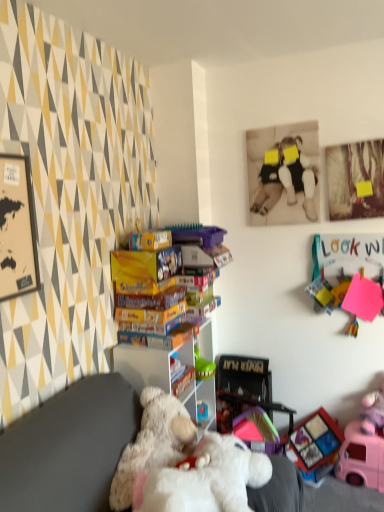
Question: Considering the relative sizes of white plastic shelf at center and pink plastic toy car at lower right, marked as the fourth toy in a top-to-bottom arrangement, in the image provided, is white plastic shelf at center smaller than pink plastic toy car at lower right, marked as the fourth toy in a top-to-bottom arrangement,?

Choices:
 (A) no
 (B) yes

Answer: (A)

Question: From a real-world perspective, is white plastic shelf at center beneath pink plastic toy car at lower right, marked as the fourth toy in a top-to-bottom arrangement?

Choices:
 (A) yes
 (B) no

Answer: (B)

Question: From a real-world perspective, is white plastic shelf at center on top of pink plastic toy car at lower right, marked as the fourth toy in a top-to-bottom arrangement?

Choices:
 (A) yes
 (B) no

Answer: (A)

Question: Can you confirm if white plastic shelf at center is wider than pink plastic toy car at lower right, marked as the fourth toy in a top-to-bottom arrangement?

Choices:
 (A) no
 (B) yes

Answer: (B)

Question: Could you tell me if white plastic shelf at center is turned towards pink plastic toy car at lower right, marked as the fourth toy in a top-to-bottom arrangement?

Choices:
 (A) yes
 (B) no

Answer: (A)

Question: In the image, is matte plastic toy at lower right, positioned as the third toy in top-to-bottom order, positioned in front of or behind white plush bear at center?

Choices:
 (A) front
 (B) behind

Answer: (B)

Question: From a real-world perspective, is matte plastic toy at lower right, positioned as the third toy in top-to-bottom order, positioned above or below white plush bear at center?

Choices:
 (A) below
 (B) above

Answer: (A)

Question: In terms of size, does matte plastic toy at lower right, which ranks as the second toy in bottom-to-top order, appear bigger or smaller than white plush bear at center?

Choices:
 (A) big
 (B) small

Answer: (B)

Question: Looking at their shapes, would you say matte plastic toy at lower right, positioned as the third toy in top-to-bottom order, is wider or thinner than white plush bear at center?

Choices:
 (A) wide
 (B) thin

Answer: (B)

Question: Does point (347, 424) appear closer or farther from the camera than point (365, 409)?

Choices:
 (A) farther
 (B) closer

Answer: (A)

Question: From the image's perspective, is pink plastic toy car at lower right, the first toy ordered from the bottom, positioned above or below pink fabric doll at lower right, arranged as the 3th toy when ordered from the bottom?

Choices:
 (A) above
 (B) below

Answer: (B)

Question: Looking at the image, does pink plastic toy car at lower right, marked as the fourth toy in a top-to-bottom arrangement, seem bigger or smaller compared to pink fabric doll at lower right, arranged as the second toy when viewed from the top?

Choices:
 (A) small
 (B) big

Answer: (B)

Question: Would you say pink plastic toy car at lower right, the first toy ordered from the bottom, is inside or outside pink fabric doll at lower right, arranged as the 3th toy when ordered from the bottom?

Choices:
 (A) inside
 (B) outside

Answer: (B)

Question: Is point (314, 432) closer or farther from the camera than point (364, 398)?

Choices:
 (A) farther
 (B) closer

Answer: (A)

Question: From a real-world perspective, is matte plastic toy at lower right, positioned as the third toy in top-to-bottom order, physically located above or below pink fabric doll at lower right, arranged as the 3th toy when ordered from the bottom?

Choices:
 (A) above
 (B) below

Answer: (B)